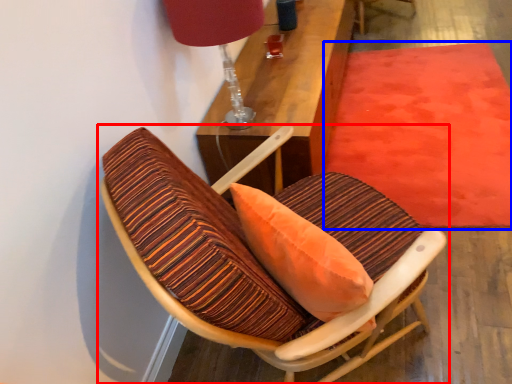
Question: Which object is closer to the camera taking this photo, chair (highlighted by a red box) or mat (highlighted by a blue box)?

Choices:
 (A) chair
 (B) mat

Answer: (A)